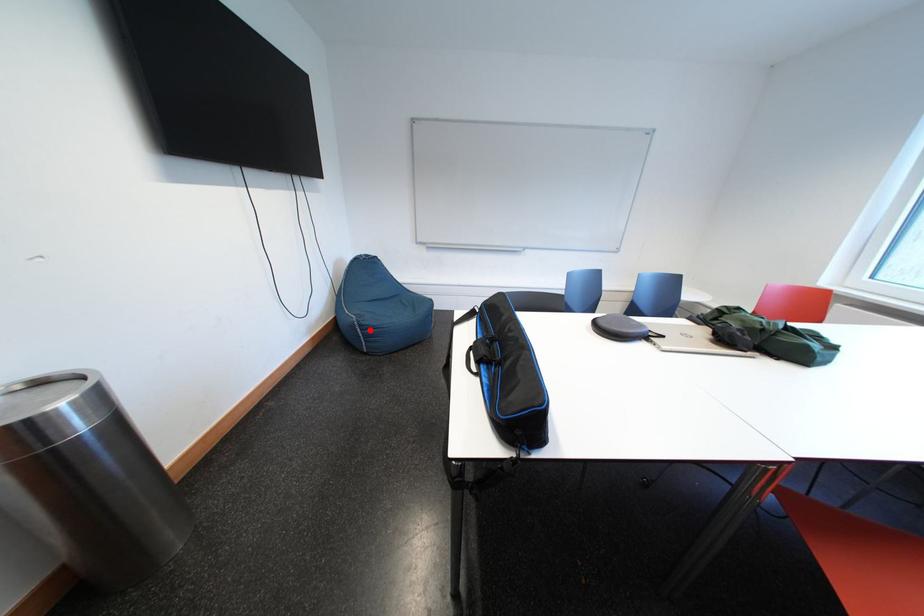
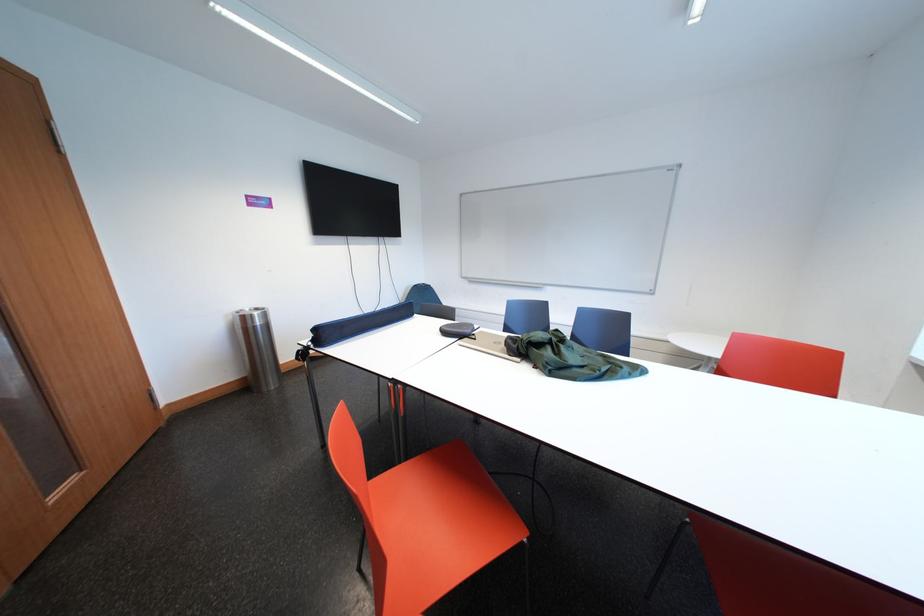
Question: I am providing you with two images of the same scene from different viewpoints. A red point is marked on the first image. At the location where the point appears in image 1, is it still visible in image 2?

Choices:
 (A) Yes
 (B) No

Answer: (B)